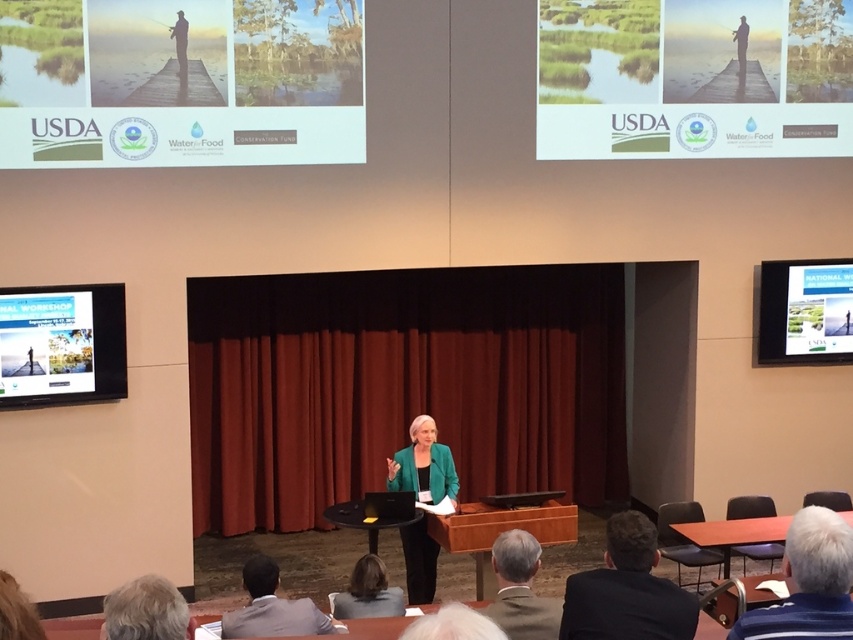
You are an attendee in the conference room and want to take a photo of the white glossy screen at upper right. Where should you position yourself to ensure the screen is fully visible in your camera frame?

To ensure the white glossy screen at upper right is fully visible in your camera frame, position yourself directly in front of the screen, facing it, and adjust your camera angle slightly downward since the screen is located at point 0.489 on the x and 0.941 on the y coordinates, which places it high up on the right side of the stage backdrop.

You are an attendee at the presentation and want to take a photo of the dark suit at lower right. Where should you position yourself to capture it in the frame?

The dark suit at lower right is located at point [627,589], so you should position yourself to the lower right side of the scene to capture it in the frame.

You are an event organizer who needs to set up a microphone stand between the black velvet curtain at center and the gray striped shirt at lower right. The stand requires at least 2 meters of space to be placed safely. Can you position it there?

The distance between the black velvet curtain at center and the gray striped shirt at lower right is 5.88 meters. Since the microphone stand needs at least 2 meters, there is sufficient space to place it between them.